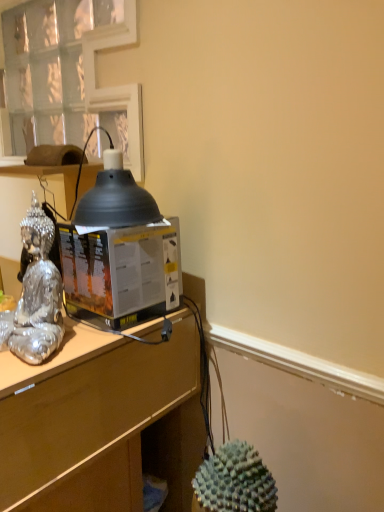
Question: From a real-world perspective, relative to matte black lampshade at upper left, is transparent plastic desktop computer at center vertically above or below?

Choices:
 (A) below
 (B) above

Answer: (A)

Question: From the image's perspective, is transparent plastic desktop computer at center located above or below matte black lampshade at upper left?

Choices:
 (A) above
 (B) below

Answer: (B)

Question: Estimate the real-world distances between objects in this image. Which object is closer to the matte black lampshade at upper center?

Choices:
 (A) clear glass window at upper left
 (B) brown matte desk at center
 (C) transparent plastic desktop computer at center
 (D) matte black lampshade at upper left
 (E) silver reflective statue at left

Answer: (C)

Question: Estimate the real-world distances between objects in this image. Which object is closer to the clear glass window at upper left?

Choices:
 (A) brown matte desk at center
 (B) matte black lampshade at upper left
 (C) matte black lampshade at upper center
 (D) transparent plastic desktop computer at center
 (E) silver reflective statue at left

Answer: (B)